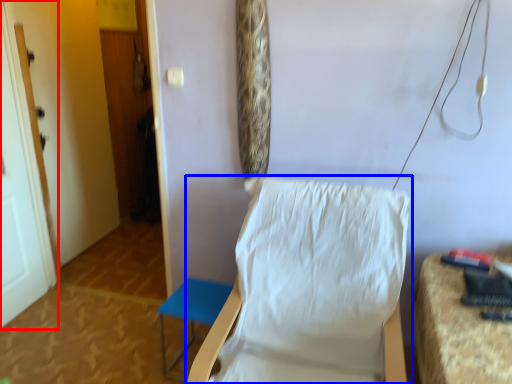
Question: Among these objects, which one is nearest to the camera, door (highlighted by a red box) or chair (highlighted by a blue box)?

Choices:
 (A) door
 (B) chair

Answer: (B)